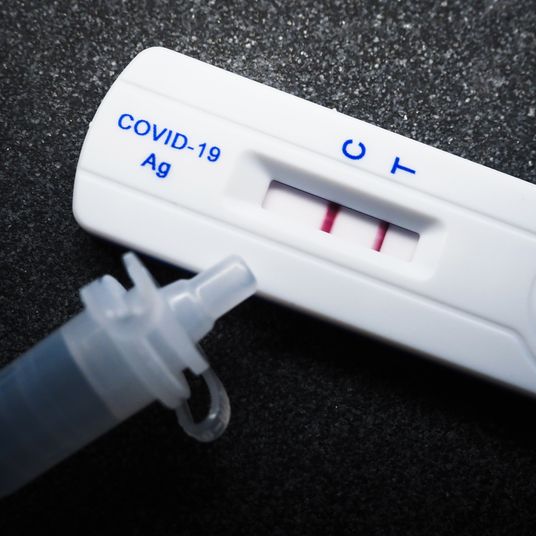
Where is `bottom left corner empty space`? This screenshot has width=536, height=536. bottom left corner empty space is located at coordinates (512, 413), (449, 438), (433, 501), (472, 525), (527, 520), (492, 469).